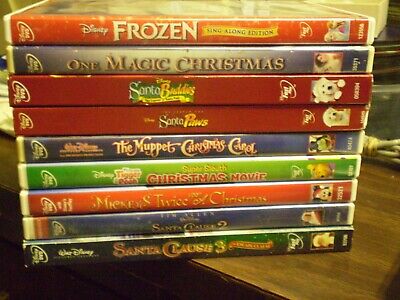
Identify the location of dvd cases. [196, 254], [210, 222], [226, 198], [243, 175], [251, 150], [256, 122], [263, 99], [272, 65], [288, 23].